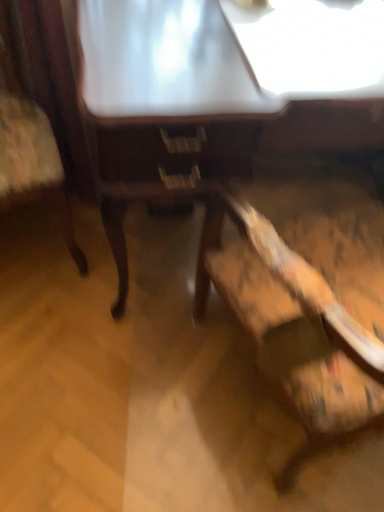
Question: From a real-world perspective, is wooden chair at lower right, the 2th chair from the left, on top of wooden table at center?

Choices:
 (A) no
 (B) yes

Answer: (B)

Question: From the image's perspective, does wooden chair at lower right, the 2th chair from the left, appear lower than wooden table at center?

Choices:
 (A) no
 (B) yes

Answer: (B)

Question: Is the depth of wooden chair at lower right, the 2th chair from the left, greater than that of wooden table at center?

Choices:
 (A) no
 (B) yes

Answer: (A)

Question: Is wooden chair at lower right, which is the 1th chair from right to left, turned away from wooden table at center?

Choices:
 (A) yes
 (B) no

Answer: (B)

Question: Can you confirm if wooden chair at lower right, the 2th chair from the left, is bigger than wooden table at center?

Choices:
 (A) yes
 (B) no

Answer: (B)

Question: Is wooden chair at lower right, the 2th chair from the left, bigger or smaller than wooden table at center?

Choices:
 (A) small
 (B) big

Answer: (A)

Question: From a real-world perspective, relative to wooden table at center, is wooden chair at lower right, the 2th chair from the left, vertically above or below?

Choices:
 (A) below
 (B) above

Answer: (B)

Question: Relative to wooden table at center, is wooden chair at lower right, which is the 1th chair from right to left, in front or behind?

Choices:
 (A) front
 (B) behind

Answer: (A)

Question: Is wooden chair at lower right, the 2th chair from the left, taller or shorter than wooden table at center?

Choices:
 (A) short
 (B) tall

Answer: (B)

Question: Would you say wooden table at center is inside or outside wooden chair at left, placed as the second chair when sorted from right to left?

Choices:
 (A) outside
 (B) inside

Answer: (A)

Question: Based on their positions, is wooden table at center located to the left or right of wooden chair at left, the first chair positioned from the left?

Choices:
 (A) left
 (B) right

Answer: (B)

Question: Is wooden table at center in front of or behind wooden chair at left, placed as the second chair when sorted from right to left, in the image?

Choices:
 (A) behind
 (B) front

Answer: (A)

Question: From the image's perspective, is wooden table at center above or below wooden chair at left, placed as the second chair when sorted from right to left?

Choices:
 (A) above
 (B) below

Answer: (B)

Question: Considering the positions of wooden chair at left, placed as the second chair when sorted from right to left, and wooden chair at lower right, which is the 1th chair from right to left, in the image, is wooden chair at left, placed as the second chair when sorted from right to left, taller or shorter than wooden chair at lower right, which is the 1th chair from right to left,?

Choices:
 (A) short
 (B) tall

Answer: (A)

Question: From a real-world perspective, relative to wooden chair at lower right, the 2th chair from the left, is wooden chair at left, the first chair positioned from the left, vertically above or below?

Choices:
 (A) above
 (B) below

Answer: (B)